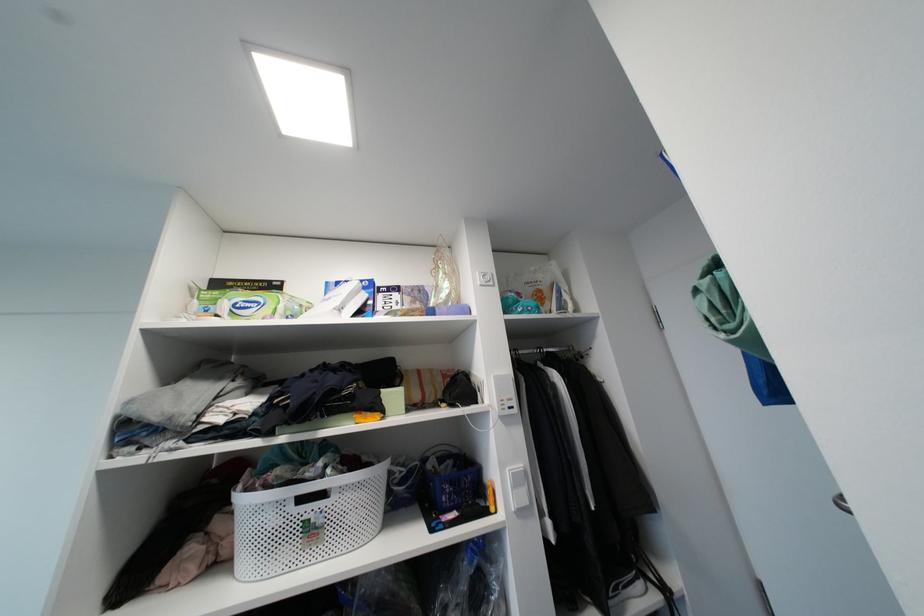
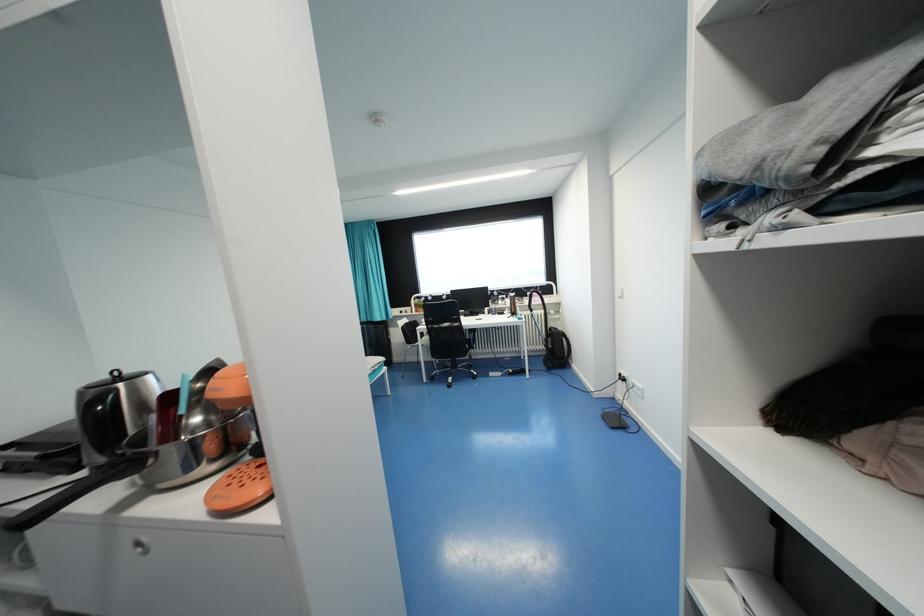
Question: The camera is either moving clockwise (left) or counter-clockwise (right) around the object. The first image is from the beginning of the video and the second image is from the end. Is the camera moving left or right when shooting the video?

Choices:
 (A) Left
 (B) Right

Answer: (B)